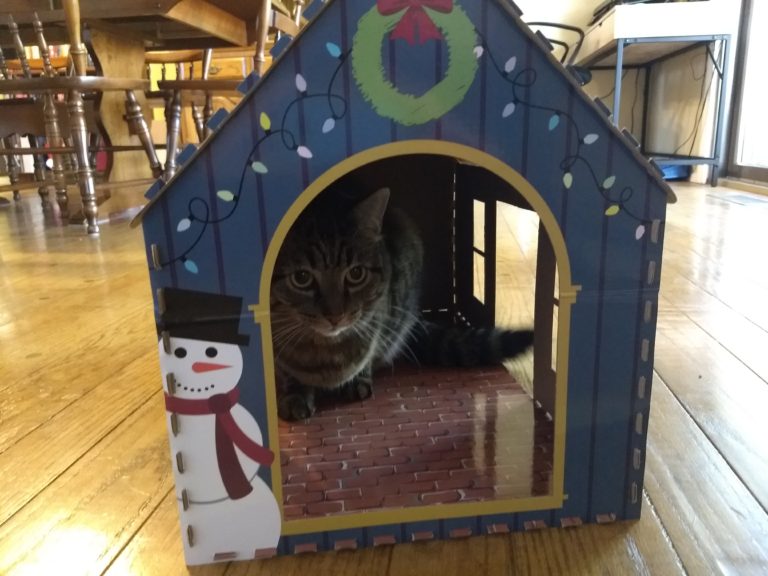
Where is `door`? door is located at coordinates coord(749,120).